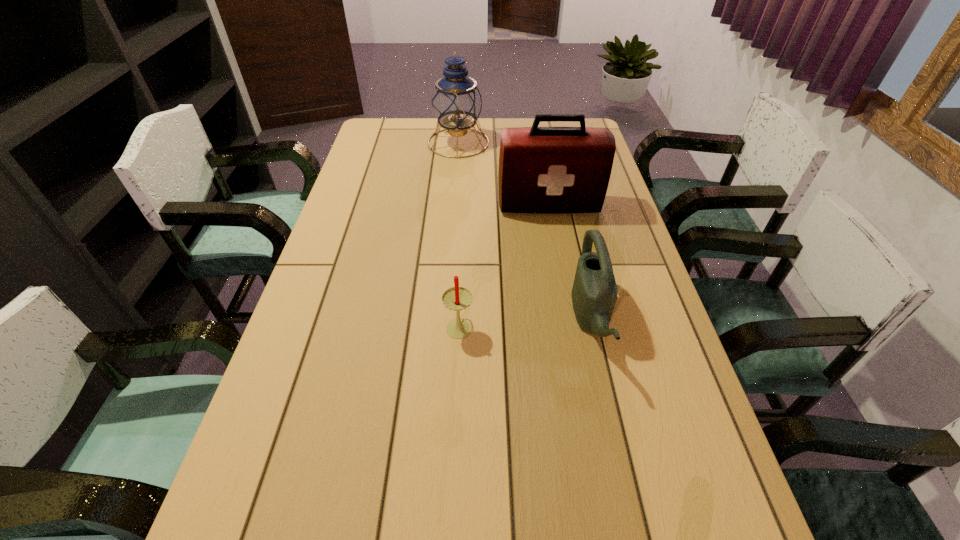
This screenshot has width=960, height=540. Identify the location of blank region between the second farthest object and the candle. (504, 266).

You are a GUI agent. You are given a task and a screenshot of the screen. Output one action in this format:
    pyautogui.click(x=<x>, y=<y>)
    Task: Click on the vacant area between the candle and the farthest object
    Image resolution: width=960 pixels, height=540 pixels.
    Given the screenshot: What is the action you would take?
    pyautogui.click(x=459, y=234)

Locate an element on the screen. The height and width of the screenshot is (540, 960). empty space that is in between the candle and the lantern is located at coordinates (459, 234).

Image resolution: width=960 pixels, height=540 pixels. What are the coordinates of `free space that is in between the candle and the watering can` in the screenshot? It's located at (525, 323).

The image size is (960, 540). Identify the location of object that is the third closest to the lantern. (457, 298).

Point out which object is positioned as the nearest to the watering can. Please provide its 2D coordinates. Your answer should be formatted as a tuple, i.e. [(x, y)], where the tuple contains the x and y coordinates of a point satisfying the conditions above.

[(542, 170)]

The width and height of the screenshot is (960, 540). Identify the location of vacant space that satisfies the following two spatial constraints: 1. on the front-facing side of the farthest object; 2. on the right side of the candle. (445, 326).

Image resolution: width=960 pixels, height=540 pixels. I want to click on blank area in the image that satisfies the following two spatial constraints: 1. on the front-facing side of the farthest object; 2. on the right side of the candle, so click(445, 326).

Locate an element on the screen. free space that satisfies the following two spatial constraints: 1. on the back side of the candle; 2. on the front-facing side of the lantern is located at coordinates (467, 143).